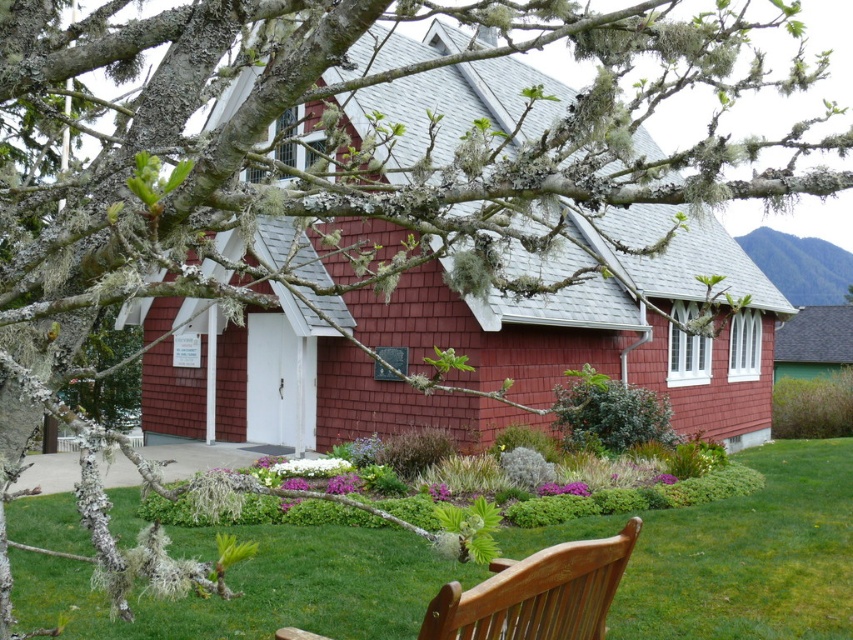
Which is above, red shingle cottage at center or wooden park bench at lower right?

red shingle cottage at center is higher up.

Which is behind, point (404, 40) or point (543, 572)?

Point (404, 40)

Identify the location of red shingle cottage at center. (601, 330).

Is point (59, 534) closer to camera compared to point (505, 627)?

No.

The width and height of the screenshot is (853, 640). What are the coordinates of `green grass at lower center` in the screenshot? It's located at click(749, 556).

Locate an element on the screen. This screenshot has height=640, width=853. green grass at lower center is located at coordinates [749, 556].

Find the location of `green grass at lower center`. green grass at lower center is located at coordinates tap(749, 556).

Does red shingle cottage at center have a larger size compared to green grass at lower center?

Yes, red shingle cottage at center is bigger than green grass at lower center.

Measure the distance between red shingle cottage at center and camera.

A distance of 9.26 feet exists between red shingle cottage at center and camera.

Identify the location of red shingle cottage at center. (601, 330).